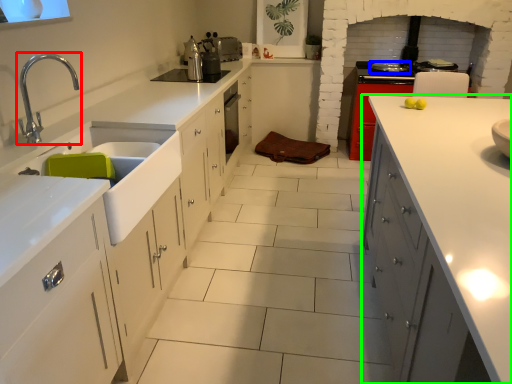
Question: Based on their relative distances, which object is nearer to tap (highlighted by a red box)? Choose from kitchen appliance (highlighted by a blue box) and cabinetry (highlighted by a green box).

Choices:
 (A) kitchen appliance
 (B) cabinetry

Answer: (B)